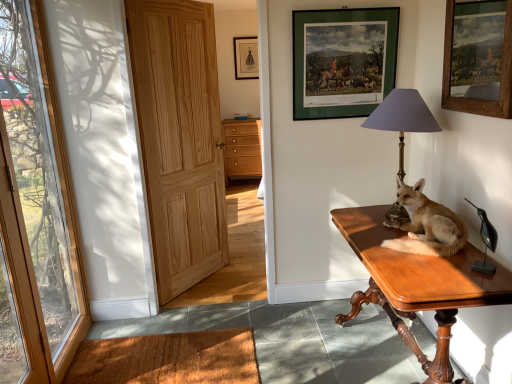
Image resolution: width=512 pixels, height=384 pixels. In order to click on vacant area in front of black glossy bird at right in this screenshot , I will do `click(489, 284)`.